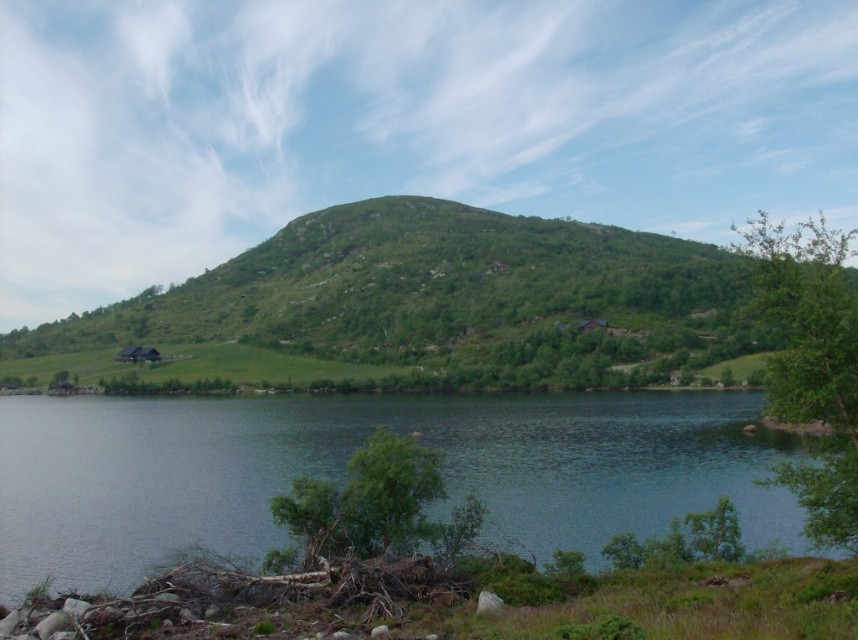
You are standing at the edge of the lake in the image and see two points marked in the scene. The first point is at coordinates point (529, 509) and the second is at point (162, 376). Which point is closer to you?

Point (529, 509) is closer to the viewer than point (162, 376).

You are standing in the middle of the landscape and see the green leafy tree at right and the green leafy tree at lower center. Which tree is closer to your right side?

The green leafy tree at right is positioned on the right side of green leafy tree at lower center, so it is closer to your right side.